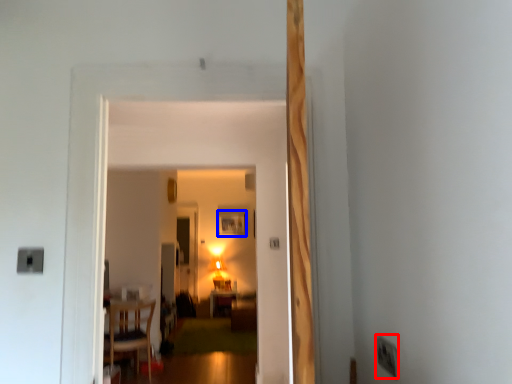
Question: Which point is further to the camera, electric outlet (highlighted by a red box) or picture frame (highlighted by a blue box)?

Choices:
 (A) electric outlet
 (B) picture frame

Answer: (B)